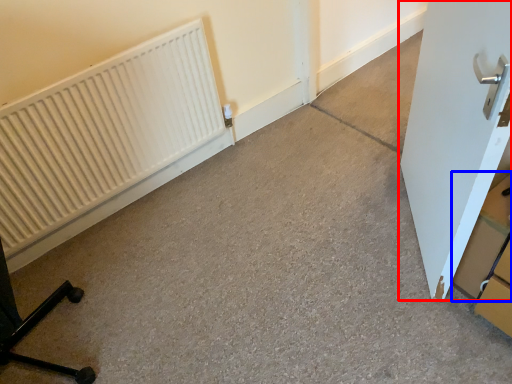
Question: Among these objects, which one is farthest to the camera, door (highlighted by a red box) or cardboard box (highlighted by a blue box)?

Choices:
 (A) door
 (B) cardboard box

Answer: (B)